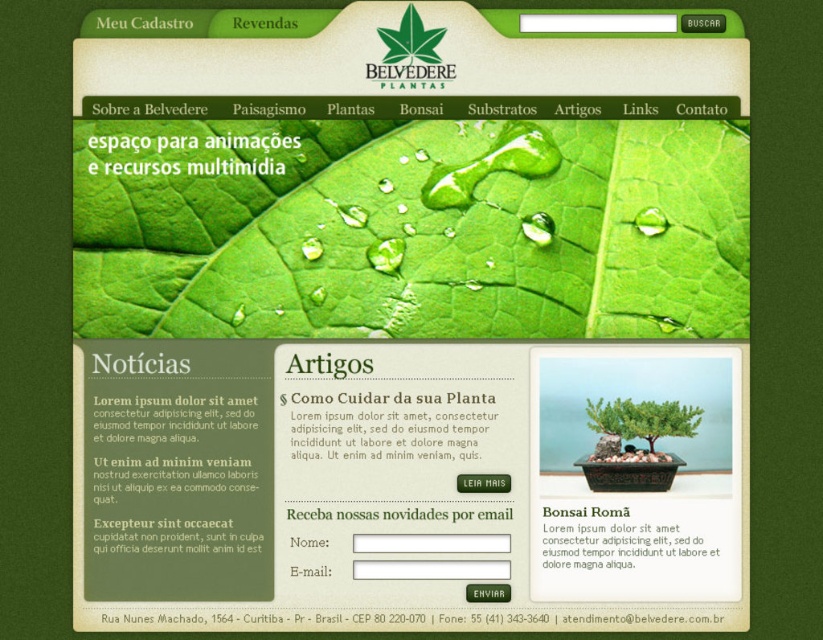
Question: Is green glossy leaf at upper center positioned before green matte bonsai tree at center?

Choices:
 (A) yes
 (B) no

Answer: (A)

Question: Among these objects, which one is nearest to the camera?

Choices:
 (A) green matte bonsai tree at center
 (B) green matte leaf at upper center
 (C) green glossy leaf at upper center

Answer: (C)

Question: Does green glossy leaf at upper center come behind green matte leaf at upper center?

Choices:
 (A) no
 (B) yes

Answer: (A)

Question: Is green glossy leaf at upper center positioned in front of green matte leaf at upper center?

Choices:
 (A) yes
 (B) no

Answer: (A)

Question: Considering the real-world distances, which object is farthest from the green glossy leaf at upper center?

Choices:
 (A) green matte leaf at upper center
 (B) green matte bonsai tree at center

Answer: (B)

Question: Which of the following is the closest to the observer?

Choices:
 (A) green glossy leaf at upper center
 (B) green matte bonsai tree at center

Answer: (A)